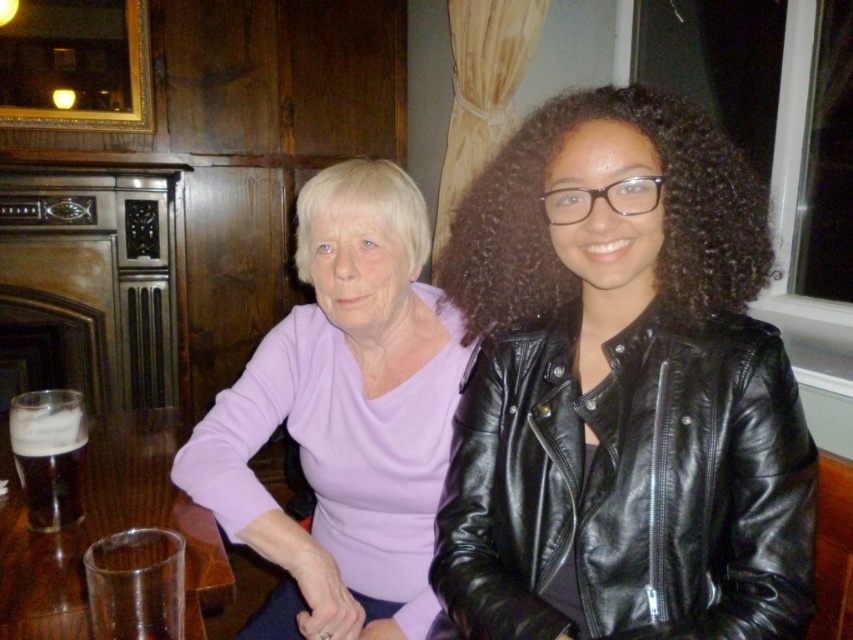
In the scene shown: You are a photographer setting up for a group photo. You need to ensure that all subjects are visible in the frame. The scene includes a matte purple sweater at upper left and a purple matte sweater at center. Which sweater should you adjust to ensure it doesn not block the other?

The matte purple sweater at upper left is not as tall as the purple matte sweater at center, so you should adjust the purple matte sweater at center to prevent it from blocking the matte purple sweater at upper left.

You are a photographer setting up for a group photo. You notice two purple sweaters in the scene. The first is the matte purple sweater at upper left, and the second is the purple matte sweater at center. Which sweater is positioned more to the left?

The purple matte sweater at center is positioned more to the left because the matte purple sweater at upper left is to its right.